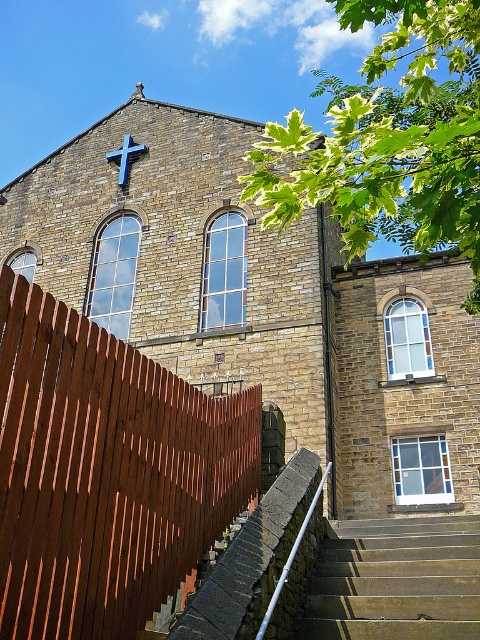
Question: Which point is closer to the camera taking this photo?

Choices:
 (A) (226, 234)
 (B) (312, 499)

Answer: (B)

Question: Among these points, which one is farthest from the camera?

Choices:
 (A) (310, 513)
 (B) (126, 163)
 (C) (372, 360)

Answer: (B)

Question: Which object is the closest to the brown wooden fence at left?

Choices:
 (A) blue painted wood cross at upper center
 (B) brown stone church at upper center
 (C) silver metallic handrail at center
 (D) concrete stairs at center

Answer: (C)

Question: Is brown wooden fence at left to the left of silver metallic handrail at center from the viewer's perspective?

Choices:
 (A) no
 (B) yes

Answer: (B)

Question: Where is brown wooden fence at left located in relation to blue painted wood cross at upper center in the image?

Choices:
 (A) above
 (B) below

Answer: (B)

Question: In this image, where is brown wooden fence at left located relative to blue painted wood cross at upper center?

Choices:
 (A) below
 (B) above

Answer: (A)